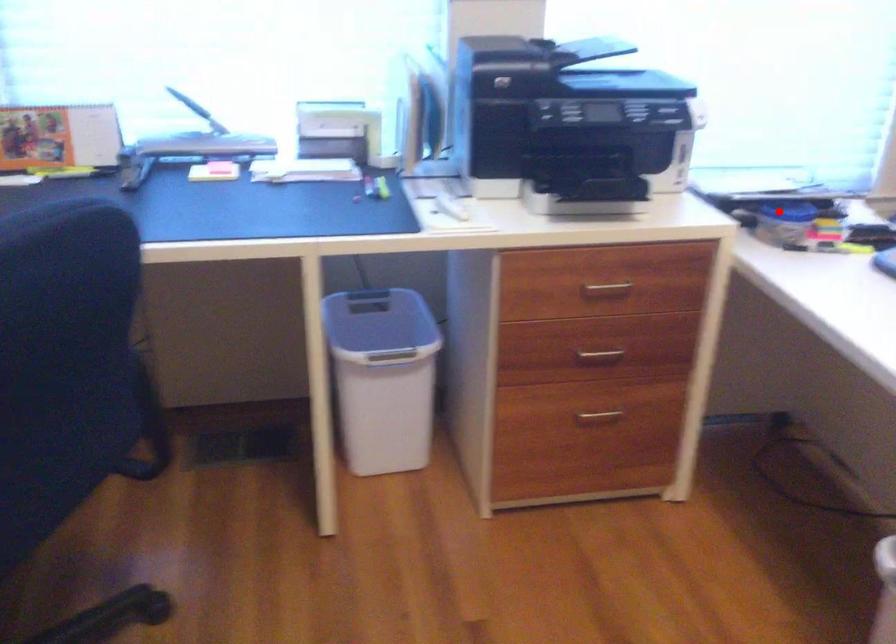
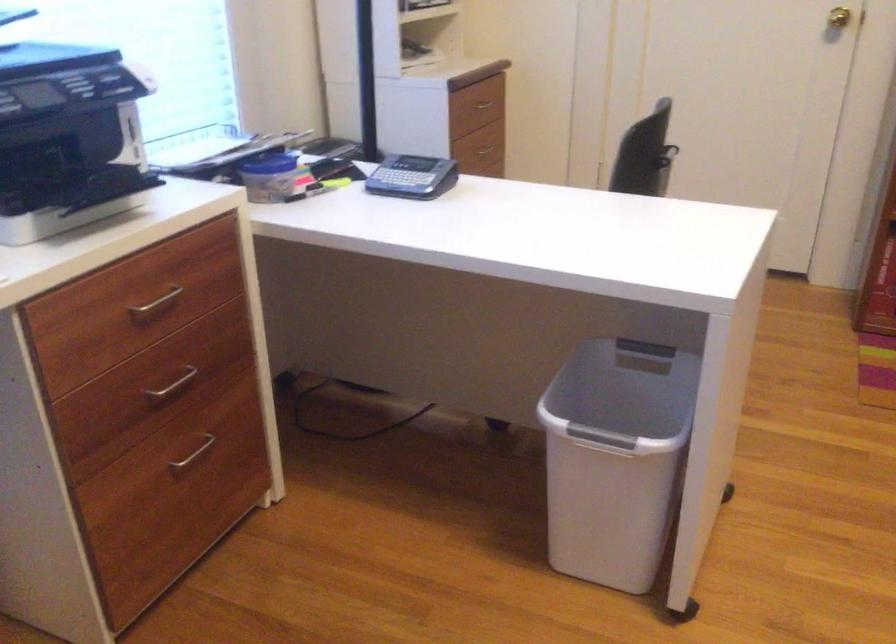
Where in the second image is the point corresponding to the highlighted location from the first image?

(270, 164)